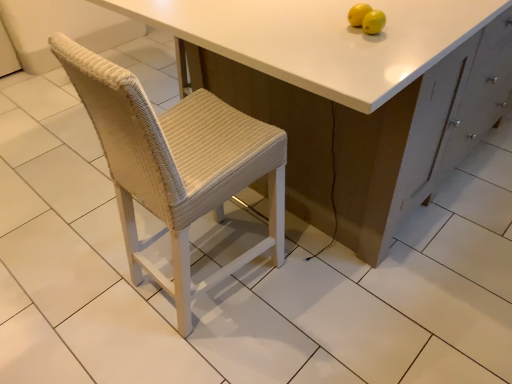
What is the approximate height of matte white cabinet at center?

91.89 centimeters.

This screenshot has width=512, height=384. What do you see at coordinates (352, 143) in the screenshot?
I see `matte white cabinet at center` at bounding box center [352, 143].

Where is `matte white cabinet at center`? This screenshot has height=384, width=512. matte white cabinet at center is located at coordinates (352, 143).

Measure the distance between point (x=362, y=5) and camera.

The depth of point (x=362, y=5) is 1.20 meters.

You are a GUI agent. You are given a task and a screenshot of the screen. Output one action in this format:
    pyautogui.click(x=<x>, y=<y>)
    Task: Click on the yellow matte lemons at upper right
    Image resolution: width=512 pixels, height=384 pixels.
    Given the screenshot: What is the action you would take?
    pyautogui.click(x=366, y=18)

Describe the element at coordinates (366, 18) in the screenshot. I see `yellow matte lemons at upper right` at that location.

Where is `matte white cabinet at center`? This screenshot has height=384, width=512. matte white cabinet at center is located at coordinates (352, 143).

Can you confirm if matte white cabinet at center is positioned to the left of yellow matte lemons at upper right?

In fact, matte white cabinet at center is to the right of yellow matte lemons at upper right.

Considering the positions of objects matte white cabinet at center and yellow matte lemons at upper right in the image provided, who is in front, matte white cabinet at center or yellow matte lemons at upper right?

Positioned in front is matte white cabinet at center.

Is point (432, 127) closer to camera compared to point (362, 14)?

No, (432, 127) is behind (362, 14).

From the image's perspective, between matte white cabinet at center and yellow matte lemons at upper right, which one is located above?

matte white cabinet at center is shown above in the image.

From a real-world perspective, is matte white cabinet at center physically below yellow matte lemons at upper right?

Yes, from a real-world perspective, matte white cabinet at center is below yellow matte lemons at upper right.

Is matte white cabinet at center thinner than yellow matte lemons at upper right?

No.

Between matte white cabinet at center and yellow matte lemons at upper right, which one has more height?

With more height is matte white cabinet at center.

Based on their sizes in the image, would you say matte white cabinet at center is bigger or smaller than yellow matte lemons at upper right?

matte white cabinet at center is bigger than yellow matte lemons at upper right.

Is matte white cabinet at center situated inside yellow matte lemons at upper right or outside?

matte white cabinet at center is not inside yellow matte lemons at upper right, it's outside.

Are matte white cabinet at center and yellow matte lemons at upper right located far from each other?

matte white cabinet at center is actually quite close to yellow matte lemons at upper right.

Is matte white cabinet at center turned away from yellow matte lemons at upper right?

No.

What's the angular difference between matte white cabinet at center and yellow matte lemons at upper right's facing directions?

They differ by 73.8 degrees in their facing directions.

Image resolution: width=512 pixels, height=384 pixels. What are the coordinates of `cabinetry below the yellow matte lemons at upper right (from a real-world perspective)` in the screenshot? It's located at (352, 143).

Which object is positioned more to the left, yellow matte lemons at upper right or matte white cabinet at center?

From the viewer's perspective, yellow matte lemons at upper right appears more on the left side.

Which object is further away from the camera, yellow matte lemons at upper right or matte white cabinet at center?

yellow matte lemons at upper right is behind.

Does point (368, 9) lie behind point (469, 48)?

No, it is in front of (469, 48).

From the image's perspective, is yellow matte lemons at upper right above matte white cabinet at center?

No, from the image's perspective, yellow matte lemons at upper right is not on top of matte white cabinet at center.

From a real-world perspective, is yellow matte lemons at upper right under matte white cabinet at center?

No, from a real-world perspective, yellow matte lemons at upper right is not below matte white cabinet at center.

In the scene shown: Considering the sizes of yellow matte lemons at upper right and matte white cabinet at center in the image, is yellow matte lemons at upper right wider or thinner than matte white cabinet at center?

yellow matte lemons at upper right is thinner than matte white cabinet at center.

Is yellow matte lemons at upper right taller or shorter than matte white cabinet at center?

In the image, yellow matte lemons at upper right appears to be shorter than matte white cabinet at center.

Between yellow matte lemons at upper right and matte white cabinet at center, which one has larger size?

matte white cabinet at center is bigger.

Is yellow matte lemons at upper right completely or partially outside of matte white cabinet at center?

Yes, yellow matte lemons at upper right is located beyond the bounds of matte white cabinet at center.

Is yellow matte lemons at upper right next to matte white cabinet at center?

No, yellow matte lemons at upper right is not touching matte white cabinet at center.

Is yellow matte lemons at upper right looking in the opposite direction of matte white cabinet at center?

That's not correct — yellow matte lemons at upper right is not looking away from matte white cabinet at center.

How different are the orientations of yellow matte lemons at upper right and matte white cabinet at center in degrees?

The angle between the facing direction of yellow matte lemons at upper right and the facing direction of matte white cabinet at center is 73.8 degrees.

The image size is (512, 384). In order to click on fruit behind the matte white cabinet at center in this screenshot , I will do `click(366, 18)`.

Locate an element on the screen. The height and width of the screenshot is (384, 512). fruit above the matte white cabinet at center (from a real-world perspective) is located at coordinates (366, 18).

You are a GUI agent. You are given a task and a screenshot of the screen. Output one action in this format:
    pyautogui.click(x=<x>, y=<y>)
    Task: Click on the fruit on the left side of matte white cabinet at center
    This screenshot has height=384, width=512.
    Given the screenshot: What is the action you would take?
    pyautogui.click(x=366, y=18)